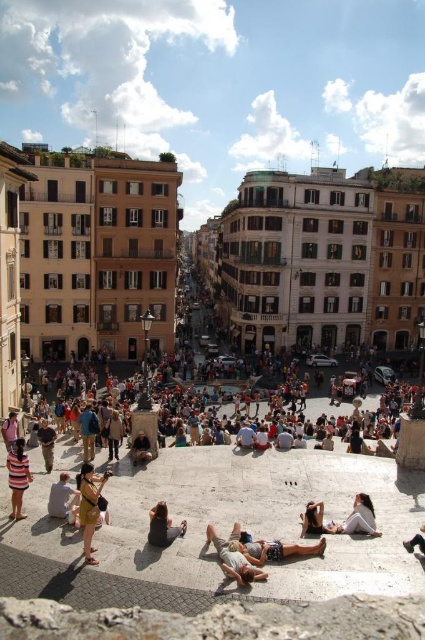
Can you confirm if light brown leather person at center is positioned to the right of leather shoe at lower right?

No, light brown leather person at center is not to the right of leather shoe at lower right.

Find the location of a particular element. Image resolution: width=425 pixels, height=640 pixels. light brown leather person at center is located at coordinates (234, 556).

Between matte gold necklace at lower center and light brown leather bag at lower left, which one appears on the left side from the viewer's perspective?

light brown leather bag at lower left

Identify the location of matte gold necklace at lower center. The image size is (425, 640). (90, 506).

Between light brown leather bag at lower left and matte black person at center, which one is positioned higher?

matte black person at center is above.

At what (x,y) coordinates should I click in order to perform the action: click on light brown leather bag at lower left. Please return your answer as a coordinate pair (x, y). The height and width of the screenshot is (640, 425). Looking at the image, I should click on (62, 499).